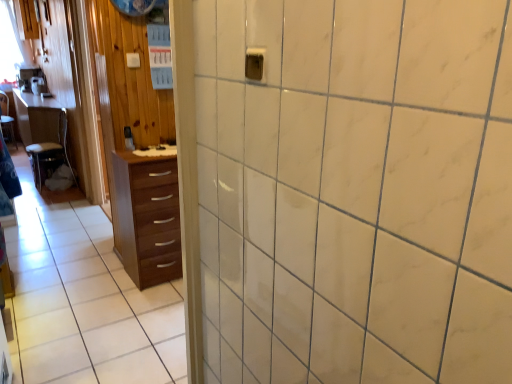
Question: Is wooden table at left taller than brown wood chest of drawers at left?

Choices:
 (A) yes
 (B) no

Answer: (A)

Question: Is wooden table at left far from brown wood chest of drawers at left?

Choices:
 (A) yes
 (B) no

Answer: (A)

Question: Is wooden table at left placed right next to brown wood chest of drawers at left?

Choices:
 (A) yes
 (B) no

Answer: (B)

Question: From a real-world perspective, does wooden table at left sit lower than brown wood chest of drawers at left?

Choices:
 (A) no
 (B) yes

Answer: (A)

Question: Is wooden table at left positioned with its back to brown wood chest of drawers at left?

Choices:
 (A) no
 (B) yes

Answer: (A)

Question: Considering the relative sizes of wooden table at left and brown wood chest of drawers at left in the image provided, is wooden table at left bigger than brown wood chest of drawers at left?

Choices:
 (A) yes
 (B) no

Answer: (A)

Question: Is brown wood chest of drawers at left aimed at wooden chair at left?

Choices:
 (A) yes
 (B) no

Answer: (B)

Question: From the image's perspective, is brown wood chest of drawers at left located beneath wooden chair at left?

Choices:
 (A) yes
 (B) no

Answer: (A)

Question: Can you confirm if brown wood chest of drawers at left is thinner than wooden chair at left?

Choices:
 (A) yes
 (B) no

Answer: (A)

Question: Is there a large distance between brown wood chest of drawers at left and wooden chair at left?

Choices:
 (A) no
 (B) yes

Answer: (B)

Question: Is the position of brown wood chest of drawers at left more distant than that of wooden chair at left?

Choices:
 (A) no
 (B) yes

Answer: (A)

Question: Is brown wood chest of drawers at left shorter than wooden chair at left?

Choices:
 (A) no
 (B) yes

Answer: (A)

Question: Is brown wood chest of drawers at left shorter than wooden table at left?

Choices:
 (A) yes
 (B) no

Answer: (A)